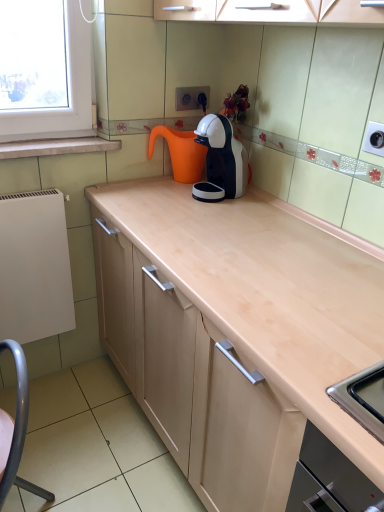
Question: From a real-world perspective, is orange matte water jug at center physically located above or below white glossy coffee machine at upper center?

Choices:
 (A) below
 (B) above

Answer: (A)

Question: Is orange matte water jug at center inside the boundaries of white glossy coffee machine at upper center, or outside?

Choices:
 (A) inside
 (B) outside

Answer: (B)

Question: Which of these objects is positioned closest to the orange matte water jug at center?

Choices:
 (A) white marble window sill at upper left
 (B) white matte radiator at left
 (C) metallic gray swivel chair at lower left
 (D) white glossy coffee machine at upper center

Answer: (D)

Question: Which object is positioned closest to the white matte radiator at left?

Choices:
 (A) white marble window sill at upper left
 (B) metallic gray swivel chair at lower left
 (C) white glossy coffee machine at upper center
 (D) orange matte water jug at center

Answer: (A)